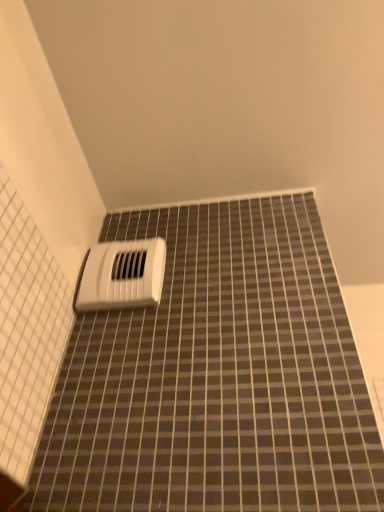
Question: Should I look upward or downward to see white plastic vent at upper center?

Choices:
 (A) down
 (B) up

Answer: (A)